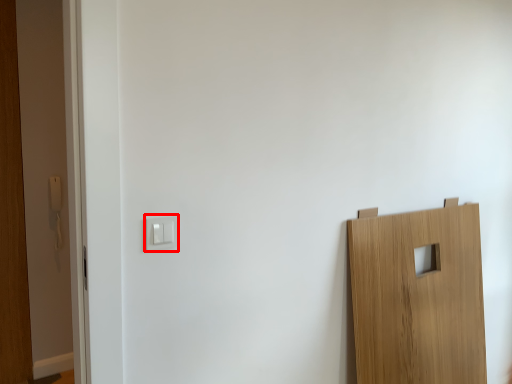
Question: From the image's perspective, what is the correct spatial positioning of light switch (annotated by the red box) in reference to light switch?

Choices:
 (A) below
 (B) above

Answer: (A)